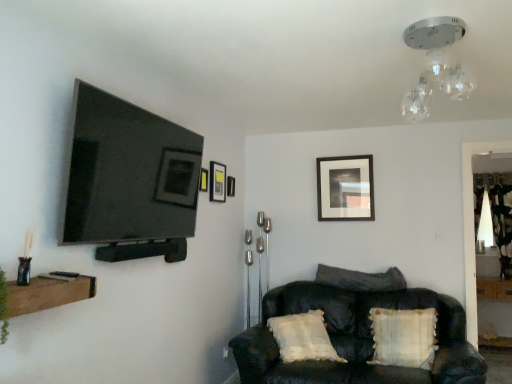
Question: Is matte black picture frame at upper center, arranged as the 2th picture frame when viewed from the left, bigger than clear glass light fixture at upper center, the second light fixture from the back?

Choices:
 (A) no
 (B) yes

Answer: (A)

Question: From the image's perspective, is matte black picture frame at upper center, the third picture frame from the right, beneath clear glass light fixture at upper center, arranged as the first light fixture when viewed from the left?

Choices:
 (A) yes
 (B) no

Answer: (A)

Question: From a real-world perspective, does matte black picture frame at upper center, the third picture frame from the right, sit lower than clear glass light fixture at upper center, the second light fixture from the back?

Choices:
 (A) yes
 (B) no

Answer: (A)

Question: Is matte black picture frame at upper center, arranged as the 2th picture frame when viewed from the left, facing towards clear glass light fixture at upper center, arranged as the first light fixture when viewed from the left?

Choices:
 (A) no
 (B) yes

Answer: (A)

Question: Is matte black picture frame at upper center, arranged as the 2th picture frame when viewed from the left, positioned beyond the bounds of clear glass light fixture at upper center, which ranks as the first light fixture in front-to-back order?

Choices:
 (A) yes
 (B) no

Answer: (A)

Question: Considering the positions of matte black picture frame at upper center, the first picture frame from the left, and clear glass light fixture at upper center, the second light fixture from the back, in the image, is matte black picture frame at upper center, the first picture frame from the left, wider or thinner than clear glass light fixture at upper center, the second light fixture from the back,?

Choices:
 (A) thin
 (B) wide

Answer: (A)

Question: From the image's perspective, relative to clear glass light fixture at upper center, the 1th light fixture in the top-to-bottom sequence, is matte black picture frame at upper center, the first picture frame from the left, above or below?

Choices:
 (A) below
 (B) above

Answer: (A)

Question: Considering the positions of point (202, 170) and point (462, 72), is point (202, 170) closer or farther from the camera than point (462, 72)?

Choices:
 (A) closer
 (B) farther

Answer: (B)

Question: Based on their positions, is matte black picture frame at upper center, the 1th picture frame positioned from the front, located to the left or right of clear glass light fixture at upper center, the 1th light fixture in the top-to-bottom sequence?

Choices:
 (A) left
 (B) right

Answer: (A)

Question: From the image's perspective, is dark fabric pillow at center, which is the 1th pillow in back-to-front order, located above or below white paper lampshade at upper right, arranged as the 2th light fixture when viewed from the front?

Choices:
 (A) above
 (B) below

Answer: (B)

Question: Does point (399, 279) appear closer or farther from the camera than point (487, 231)?

Choices:
 (A) closer
 (B) farther

Answer: (A)

Question: Which is correct: dark fabric pillow at center, the first pillow viewed from the top, is inside white paper lampshade at upper right, arranged as the 2th light fixture when viewed from the front, or outside of it?

Choices:
 (A) outside
 (B) inside

Answer: (A)

Question: Based on their sizes in the image, would you say dark fabric pillow at center, which ranks as the 2th pillow in front-to-back order, is bigger or smaller than white paper lampshade at upper right, the 1th light fixture in the back-to-front sequence?

Choices:
 (A) big
 (B) small

Answer: (A)

Question: Choose the correct answer: Is matte black picture frame at upper center, positioned as the 4th picture frame in front-to-back order, inside clear glass light fixture at upper center, the second light fixture from the back, or outside it?

Choices:
 (A) outside
 (B) inside

Answer: (A)

Question: Is point (334, 203) positioned closer to the camera than point (462, 79)?

Choices:
 (A) closer
 (B) farther

Answer: (B)